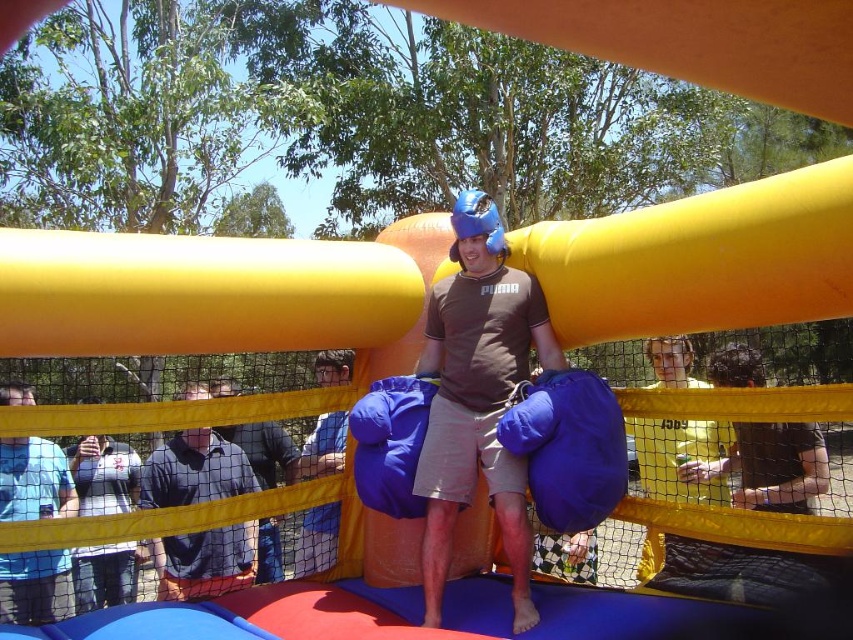
Question: Based on their relative distances, which object is nearer to the matte brown t-shirt at center?

Choices:
 (A) dark gray polo shirt at center
 (B) white matte shirt at center
 (C) blue t-shirt at center

Answer: (A)

Question: Can you confirm if white matte shirt at center is positioned below blue fabric bag at center?

Choices:
 (A) yes
 (B) no

Answer: (A)

Question: Can you confirm if dark gray polo shirt at center is positioned above blue t-shirt at center?

Choices:
 (A) yes
 (B) no

Answer: (A)

Question: Is matte brown t-shirt at center above blue fabric bag at center?

Choices:
 (A) no
 (B) yes

Answer: (B)

Question: Estimate the real-world distances between objects in this image. Which object is closer to the dark blue shirt at center?

Choices:
 (A) dark gray polo shirt at center
 (B) blue t-shirt at center

Answer: (A)

Question: Which object is farther from the camera taking this photo?

Choices:
 (A) blue fabric bag at center
 (B) blue t-shirt at center

Answer: (A)